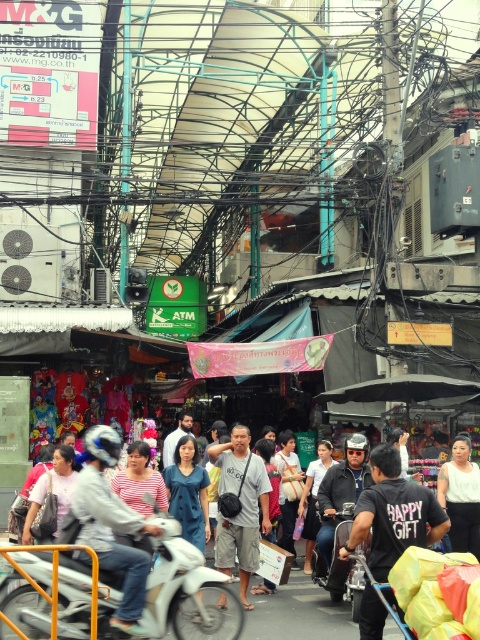
Question: Which object is farther from the camera taking this photo?

Choices:
 (A) dark blue shirt at center
 (B) white matte shirt at center
 (C) striped fabric shirt at center
 (D) black cotton t-shirt at center

Answer: (B)

Question: Is striped fabric shirt at center to the left of matte black helmet at center from the viewer's perspective?

Choices:
 (A) no
 (B) yes

Answer: (B)

Question: Is white matte motorcycle at center behind striped fabric shirt at center?

Choices:
 (A) no
 (B) yes

Answer: (B)

Question: Which object is closer to the camera taking this photo?

Choices:
 (A) matte black helmet at center
 (B) white matte shirt at center
 (C) black cotton t-shirt at center
 (D) dark blue shirt at center

Answer: (C)

Question: Does striped fabric shirt at center appear on the right side of gray cotton t-shirt at center?

Choices:
 (A) no
 (B) yes

Answer: (A)

Question: Estimate the real-world distances between objects in this image. Which object is farther from the gray cotton t-shirt at center?

Choices:
 (A) striped fabric shirt at center
 (B) matte black helmet at center
 (C) white matte shirt at center

Answer: (A)